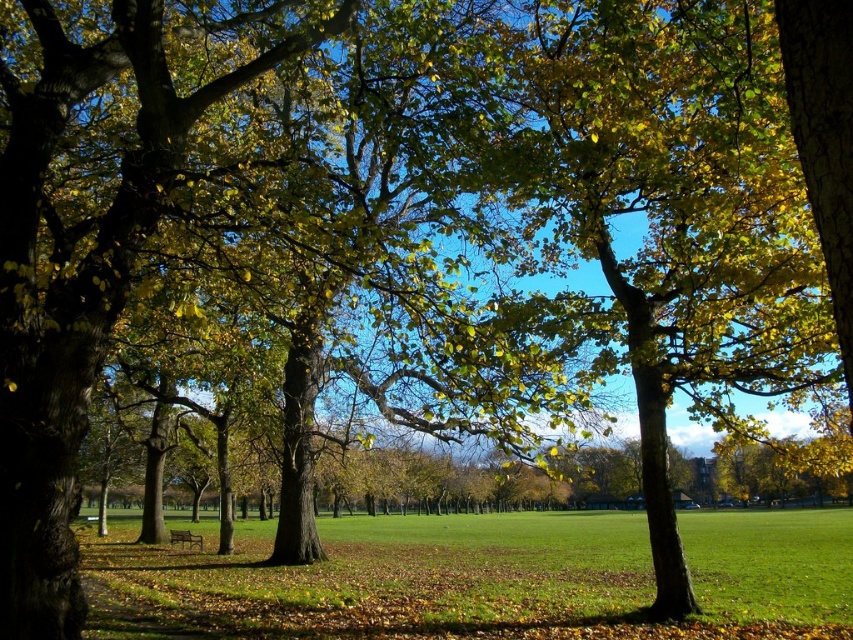
Can you confirm if green grassy field at center is positioned to the right of wooden bench at center?

Indeed, green grassy field at center is positioned on the right side of wooden bench at center.

Between green grassy field at center and wooden bench at center, which one has less height?

Standing shorter between the two is wooden bench at center.

Where is `green grassy field at center`? This screenshot has height=640, width=853. green grassy field at center is located at coordinates (479, 579).

This screenshot has height=640, width=853. In order to click on green grassy field at center in this screenshot , I will do `click(479, 579)`.